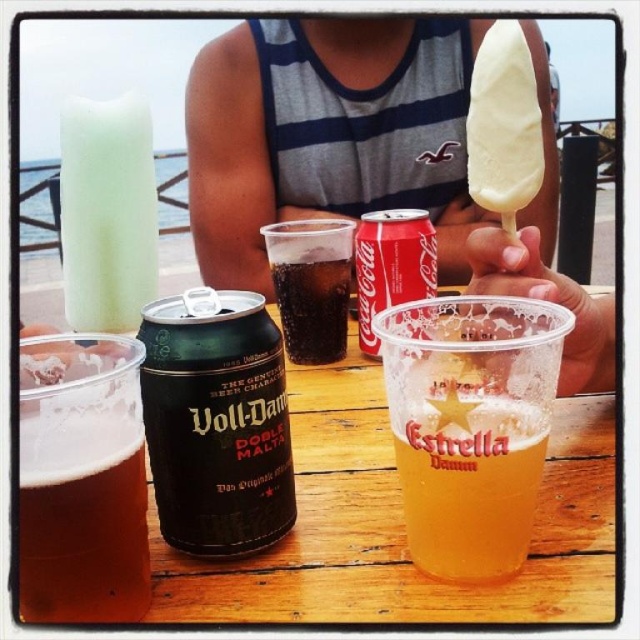
Question: Observing the image, what is the correct spatial positioning of white creamy ice cream at upper center in reference to brown matte can at lower left?

Choices:
 (A) left
 (B) right

Answer: (B)

Question: Considering the real-world distances, which object is closest to the dark brown glass at center?

Choices:
 (A) white creamy ice cream at upper center
 (B) black matte can at center
 (C) green matte can at center

Answer: (C)

Question: Which point is closer to the camera?

Choices:
 (A) (371, 230)
 (B) (456, 406)
 (C) (269, 380)
 (D) (292, 317)

Answer: (B)

Question: Among these points, which one is nearest to the camera?

Choices:
 (A) (129, 561)
 (B) (291, 278)
 (C) (554, 184)

Answer: (A)

Question: Is black matte can at center below green matte can at center?

Choices:
 (A) yes
 (B) no

Answer: (A)

Question: Is the position of brown matte can at lower left less distant than that of green matte can at center?

Choices:
 (A) no
 (B) yes

Answer: (B)